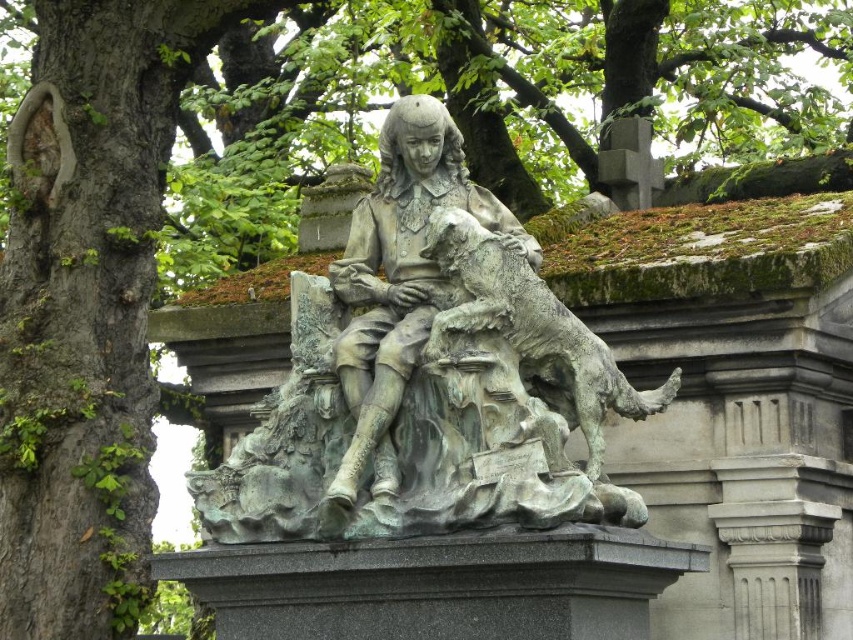
Is green patinated bronze statue at center smaller than bronze statue at center?

No, green patinated bronze statue at center is not smaller than bronze statue at center.

Is point (524, 472) closer to camera compared to point (364, 410)?

Yes, point (524, 472) is closer to viewer.

Is point (321, 378) closer to viewer compared to point (386, 328)?

No, it is behind (386, 328).

Identify the location of green patinated bronze statue at center. The image size is (853, 640). (427, 372).